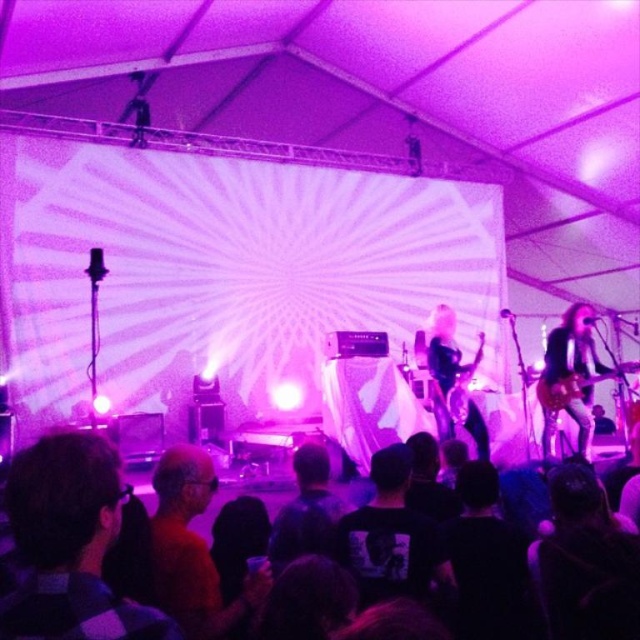
Based on the photo, you are standing at the front of the concert venue and notice the plaid shirt at lower left and the black fabric crowd at lower center. Which object is closer to you?

The plaid shirt at lower left is closer to you since it is further to the viewer than the black fabric crowd at lower center.